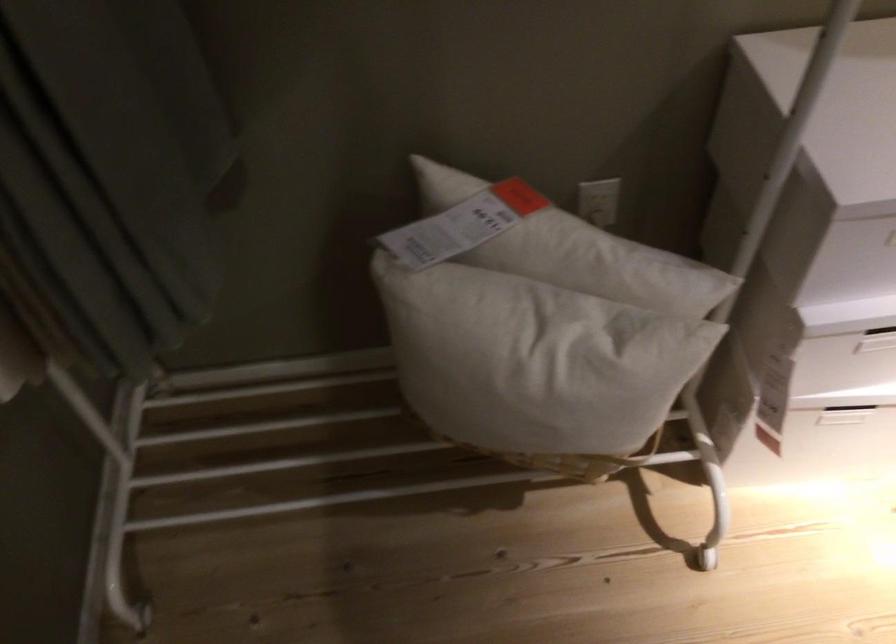
Where would you pull the drawer handle cutout? Please return your answer as a coordinate pair (x, y).

(874, 328)